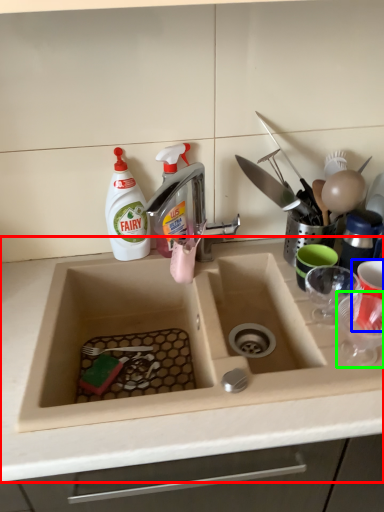
Question: Which object is positioned closest to countertop (highlighted by a red box)? Select from tableware (highlighted by a blue box) and tableware (highlighted by a green box).

Choices:
 (A) tableware
 (B) tableware

Answer: (B)